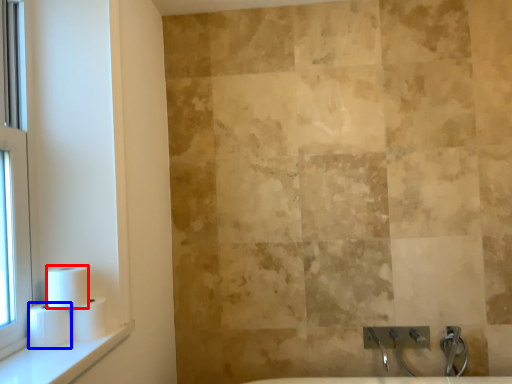
Question: Which object is closer to the camera taking this photo, toilet paper (highlighted by a red box) or toilet paper (highlighted by a blue box)?

Choices:
 (A) toilet paper
 (B) toilet paper

Answer: (B)